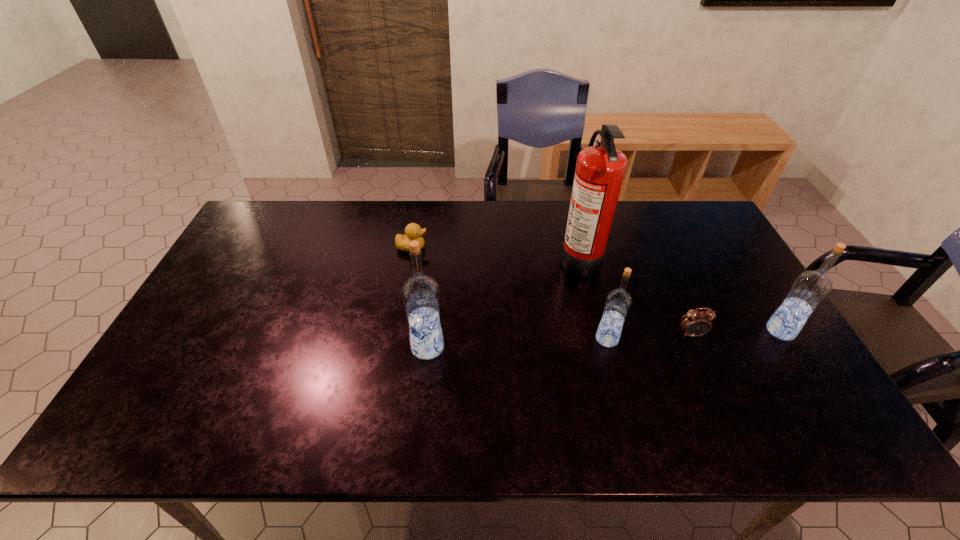
Where is `vacant space situated on the left of the third tallest object`? This screenshot has height=540, width=960. vacant space situated on the left of the third tallest object is located at coordinates (682, 330).

You are a GUI agent. You are given a task and a screenshot of the screen. Output one action in this format:
    pyautogui.click(x=<x>, y=<y>)
    Task: Click on the vacant region located 0.150m on the face of the second object from right to left
    The image size is (960, 540).
    Given the screenshot: What is the action you would take?
    pyautogui.click(x=715, y=389)

At what (x,y) coordinates should I click in order to perform the action: click on free space located facing forward on the duckling. Please return your answer as a coordinate pair (x, y). The width and height of the screenshot is (960, 540). Looking at the image, I should click on (456, 247).

The height and width of the screenshot is (540, 960). I want to click on vacant space situated on the front-facing side of the tallest object, so click(x=463, y=256).

Where is `vacant space located 0.270m on the front-facing side of the tallest object`? vacant space located 0.270m on the front-facing side of the tallest object is located at coordinates (475, 256).

What are the coordinates of `blank space located 0.300m on the front-facing side of the tallest object` in the screenshot? It's located at [x=466, y=256].

Where is `duckling situated at the far edge`? duckling situated at the far edge is located at coordinates point(413,231).

Image resolution: width=960 pixels, height=540 pixels. I want to click on fire extinguisher at the far edge, so click(600, 169).

Locate an element on the screen. object at the right edge is located at coordinates (810, 288).

I want to click on vacant position at the far edge of the desktop, so click(x=534, y=217).